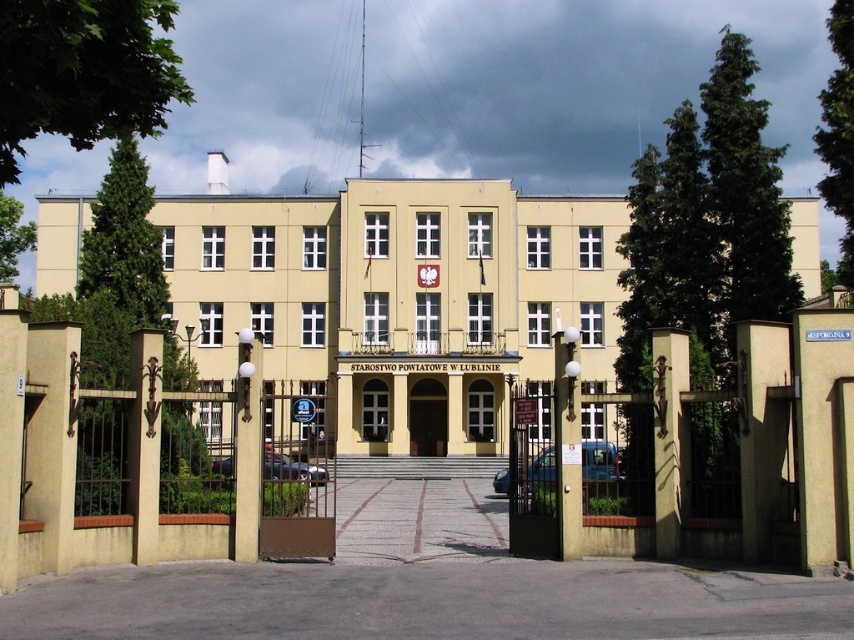
You are standing at the entrance of the beige concrete building at center. Which direction should you face to see the ornate gate in front of the building?

Since the ornate gate is in front of the beige concrete building at center, you should face the direction opposite to the building entrance to see the gate.

Consider the image. You are standing at point (398, 291). Which object is directly in front of you?

The beige concrete building at center is directly in front of you at point (398, 291).

You are a delivery person trying to enter the beige concrete building at center. You see the brown wooden door at center. Which object should you approach to enter the building?

The brown wooden door at center is the entrance to the beige concrete building at center, so you should approach the brown wooden door at center to enter the building.